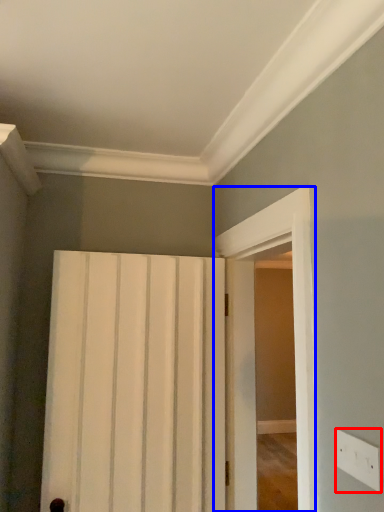
Question: Which object appears closest to the camera in this image, electric outlet (highlighted by a red box) or screen door (highlighted by a blue box)?

Choices:
 (A) electric outlet
 (B) screen door

Answer: (A)